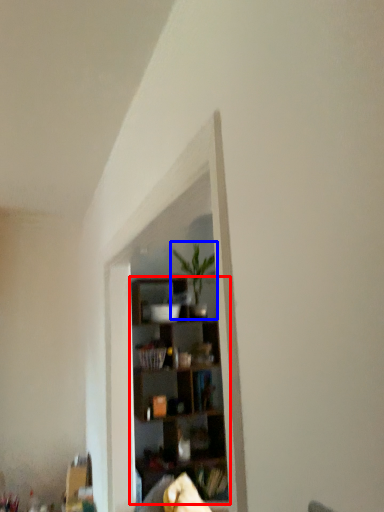
Question: Among these objects, which one is farthest to the camera, shelf (highlighted by a red box) or houseplant (highlighted by a blue box)?

Choices:
 (A) shelf
 (B) houseplant

Answer: (B)